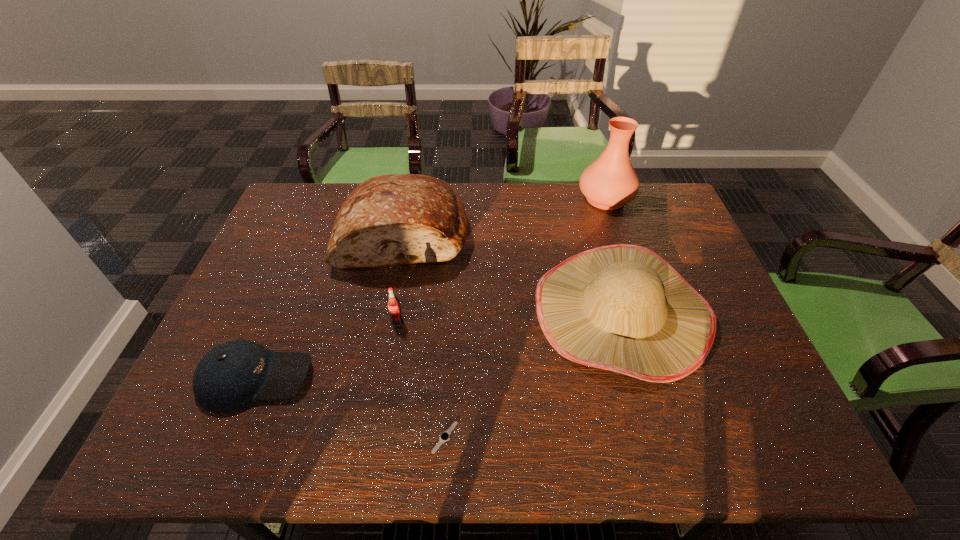
This screenshot has height=540, width=960. I want to click on vacant position at the far edge of the desktop, so click(x=489, y=199).

In order to click on blank space at the near edge of the desktop in this screenshot , I will do `click(389, 418)`.

Identify the location of free space at the left edge of the desktop. (235, 308).

You are a GUI agent. You are given a task and a screenshot of the screen. Output one action in this format:
    pyautogui.click(x=<x>, y=<y>)
    Task: Click on the vacant position at the right edge of the desktop
    The image size is (960, 540).
    Given the screenshot: What is the action you would take?
    pyautogui.click(x=725, y=348)

Image resolution: width=960 pixels, height=540 pixels. In the image, there is a desktop. Find the location of `vacant space at the far right corner`. vacant space at the far right corner is located at coordinates (662, 221).

I want to click on free spot between the bread and the fourth shortest object, so click(513, 272).

Locate an element on the screen. free point between the soda bottle and the fourth shortest object is located at coordinates (509, 316).

The height and width of the screenshot is (540, 960). Identify the location of blank region between the second shortest object and the fourth tallest object. (326, 350).

In order to click on vacant space in between the sunhat and the fourth tallest object in this screenshot , I will do `click(509, 316)`.

Identify the location of vacant space that is in between the shortest object and the sunhat. The image size is (960, 540). (533, 374).